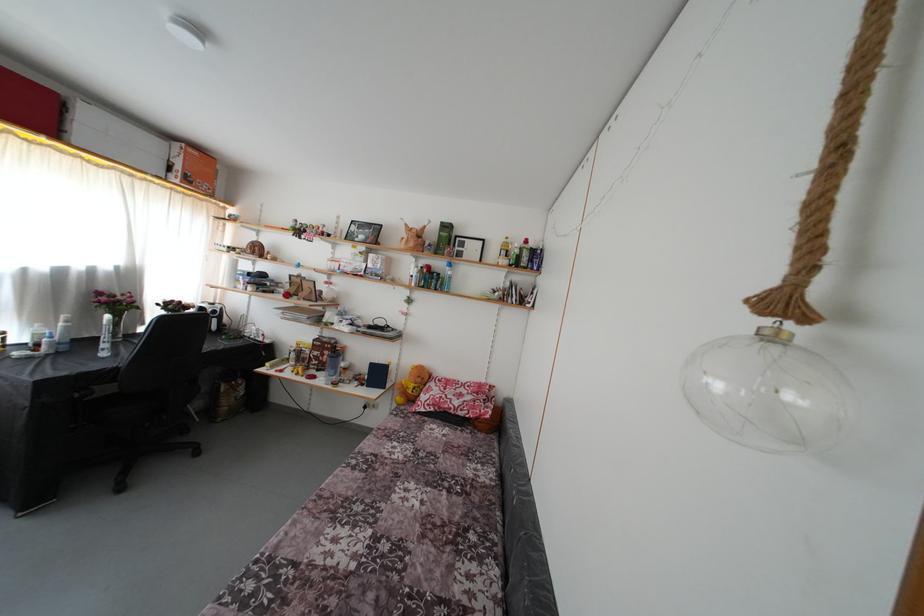
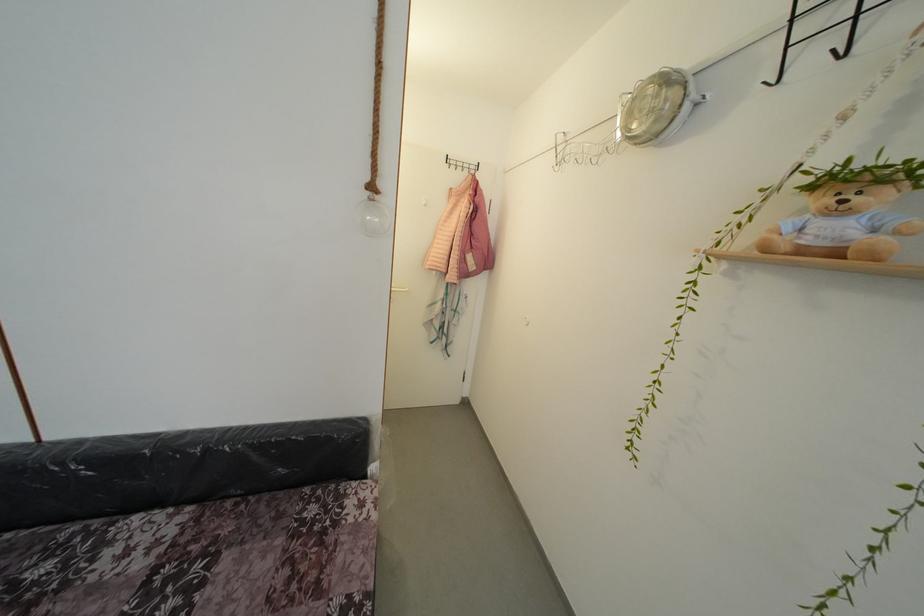
Locate, in the second image, the point that corresponds to the point at 772,326 in the first image.

(373, 199)